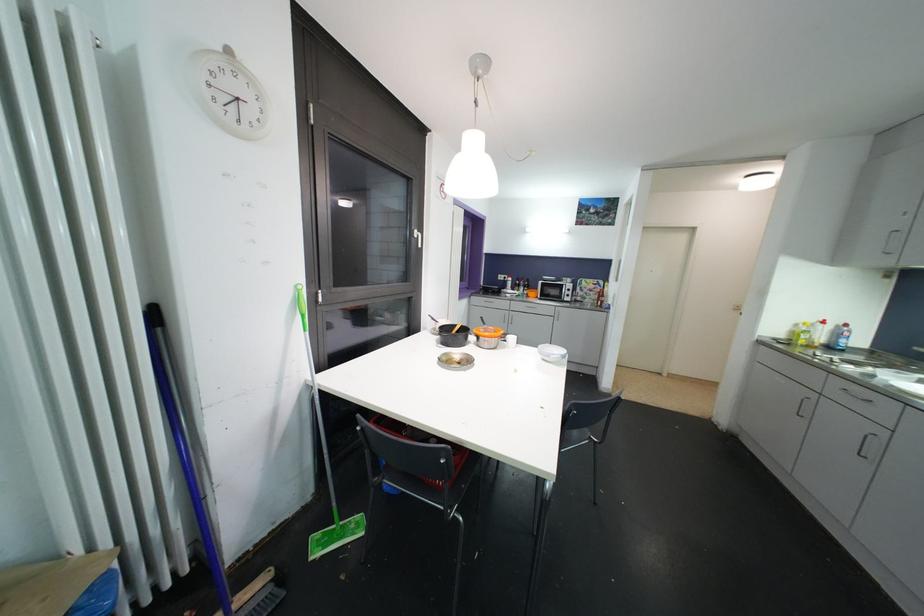
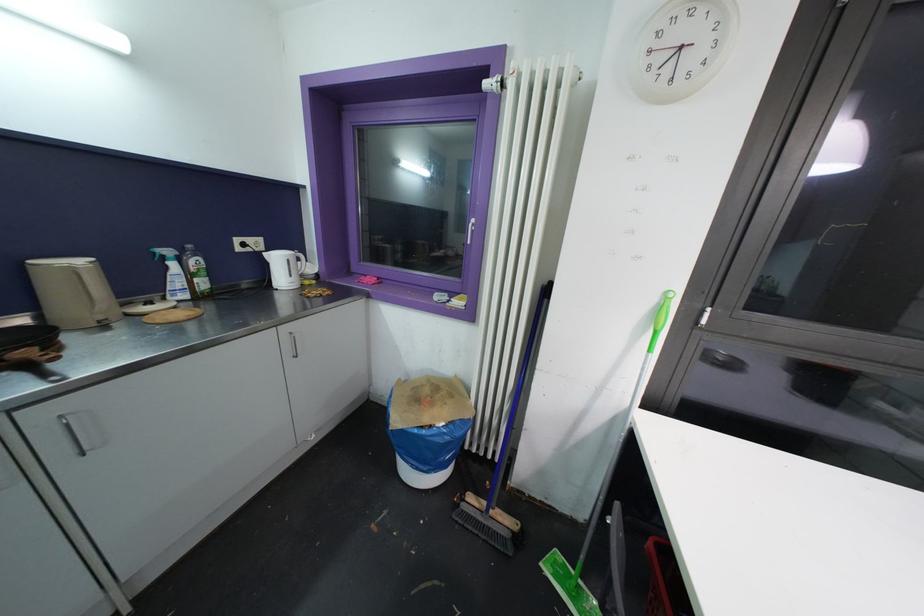
The point at [308,334] is marked in the first image. Where is the corresponding point in the second image?

(652, 354)